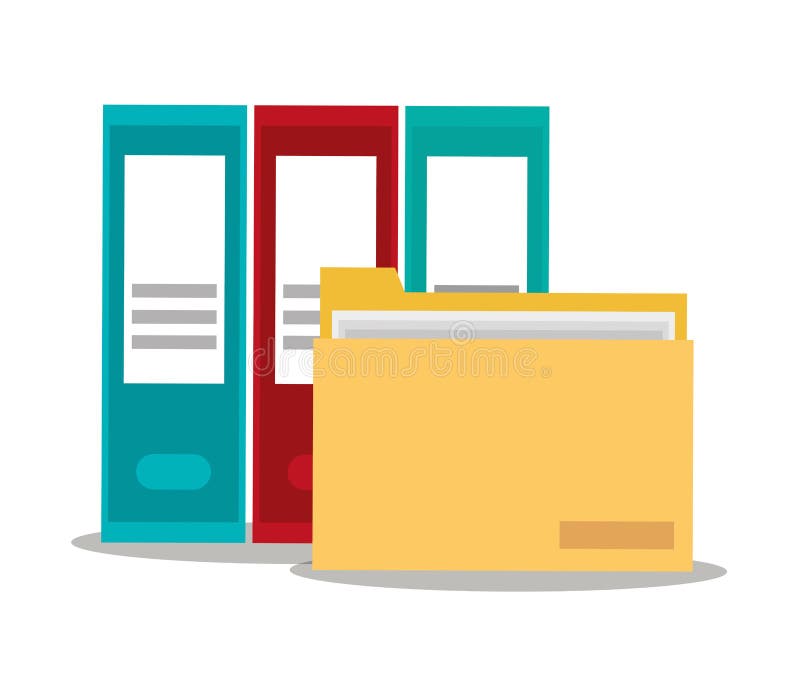
You are a GUI agent. You are given a task and a screenshot of the screen. Output one action in this format:
    pyautogui.click(x=<x>, y=<y>)
    Task: Click on the brown folder
    
    Given the screenshot: What is the action you would take?
    pyautogui.click(x=458, y=475)